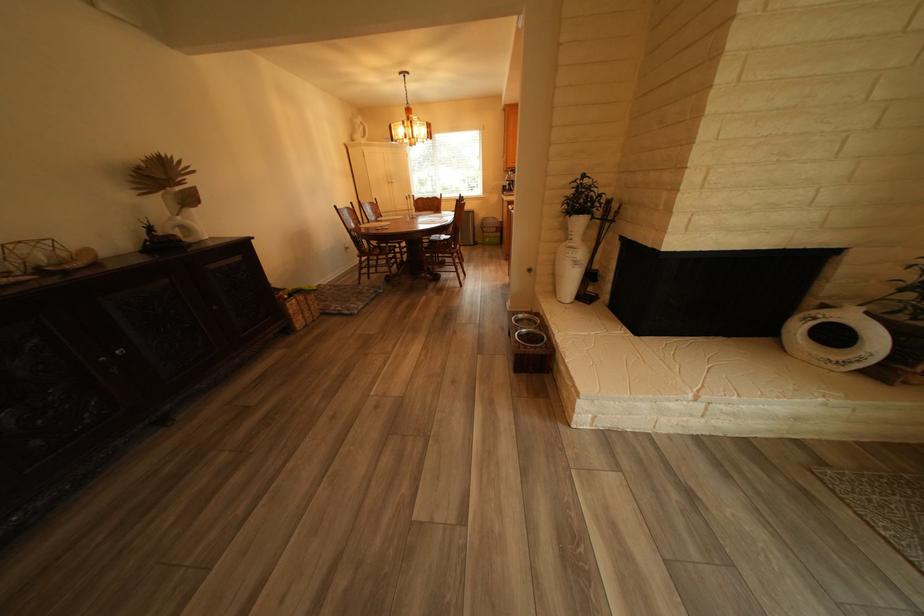
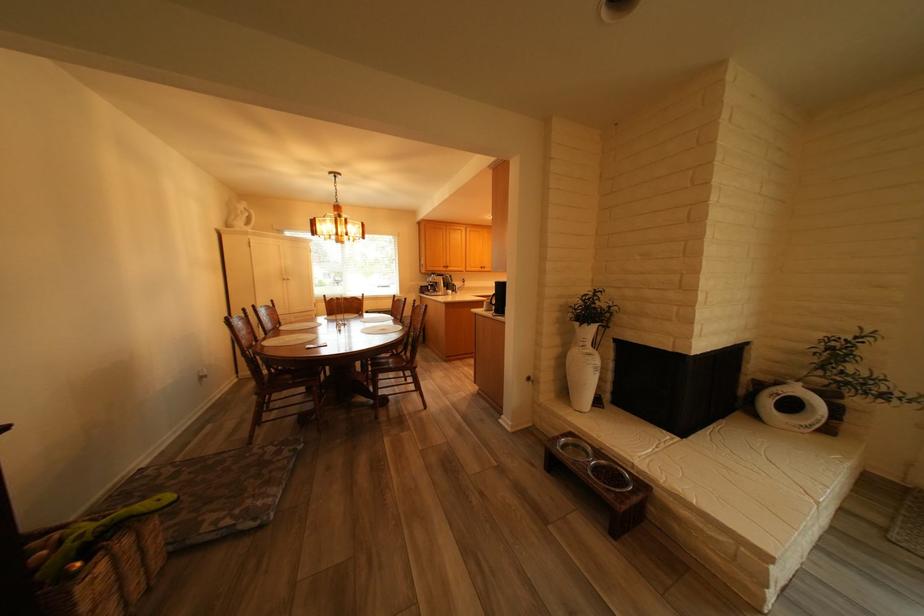
Locate, in the second image, the point that corresponds to [393,220] in the first image.

(295, 330)